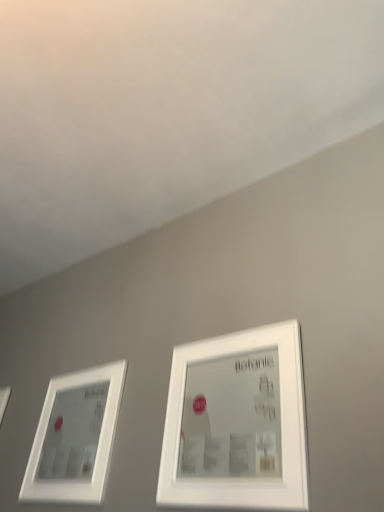
Describe the element at coordinates (237, 423) in the screenshot. This screenshot has height=512, width=384. I see `white matte picture frame at center, positioned as the first picture frame in right-to-left order` at that location.

This screenshot has height=512, width=384. Identify the location of white matte picture frame at center, the 2th picture frame positioned from the left. (237, 423).

How much space does white matte picture frame at center, positioned as the first picture frame in right-to-left order, occupy vertically?

white matte picture frame at center, positioned as the first picture frame in right-to-left order, is 16.57 inches in height.

Measure the distance between white matte picture frame at center, the 2th picture frame positioned from the left, and camera.

A distance of 32.83 inches exists between white matte picture frame at center, the 2th picture frame positioned from the left, and camera.

This screenshot has height=512, width=384. Describe the element at coordinates (75, 437) in the screenshot. I see `white matte picture frame at left, the second picture frame viewed from the right` at that location.

Find the location of `white matte picture frame at left, the second picture frame viewed from the right`. white matte picture frame at left, the second picture frame viewed from the right is located at coordinates (75, 437).

The height and width of the screenshot is (512, 384). What are the coordinates of `white matte picture frame at center, the 2th picture frame positioned from the left` in the screenshot? It's located at (237, 423).

Which object is positioned more to the right, white matte picture frame at left, which ranks as the 1th picture frame in left-to-right order, or white matte picture frame at center, the 2th picture frame positioned from the left?

From the viewer's perspective, white matte picture frame at center, the 2th picture frame positioned from the left, appears more on the right side.

Is white matte picture frame at left, the second picture frame viewed from the right, positioned before white matte picture frame at center, positioned as the first picture frame in right-to-left order?

No.

Does point (113, 381) come closer to viewer compared to point (281, 335)?

No, it is not.

In the scene shown: From the image's perspective, does white matte picture frame at left, which ranks as the 1th picture frame in left-to-right order, appear higher than white matte picture frame at center, positioned as the first picture frame in right-to-left order?

No, from the image's perspective, white matte picture frame at left, which ranks as the 1th picture frame in left-to-right order, is not over white matte picture frame at center, positioned as the first picture frame in right-to-left order.

From a real-world perspective, who is located higher, white matte picture frame at left, the second picture frame viewed from the right, or white matte picture frame at center, the 2th picture frame positioned from the left?

white matte picture frame at left, the second picture frame viewed from the right.

Looking at their sizes, would you say white matte picture frame at left, which ranks as the 1th picture frame in left-to-right order, is wider or thinner than white matte picture frame at center, the 2th picture frame positioned from the left?

Clearly, white matte picture frame at left, which ranks as the 1th picture frame in left-to-right order, has more width compared to white matte picture frame at center, the 2th picture frame positioned from the left.

Does white matte picture frame at left, the second picture frame viewed from the right, have a lesser height compared to white matte picture frame at center, the 2th picture frame positioned from the left?

No, white matte picture frame at left, the second picture frame viewed from the right, is not shorter than white matte picture frame at center, the 2th picture frame positioned from the left.

Can you confirm if white matte picture frame at left, which ranks as the 1th picture frame in left-to-right order, is bigger than white matte picture frame at center, the 2th picture frame positioned from the left?

Indeed, white matte picture frame at left, which ranks as the 1th picture frame in left-to-right order, has a larger size compared to white matte picture frame at center, the 2th picture frame positioned from the left.

Would you say white matte picture frame at left, which ranks as the 1th picture frame in left-to-right order, is outside white matte picture frame at center, positioned as the first picture frame in right-to-left order?

Absolutely, white matte picture frame at left, which ranks as the 1th picture frame in left-to-right order, is external to white matte picture frame at center, positioned as the first picture frame in right-to-left order.

Is white matte picture frame at left, which ranks as the 1th picture frame in left-to-right order, next to white matte picture frame at center, positioned as the first picture frame in right-to-left order?

They are not placed beside each other.

Is white matte picture frame at left, which ranks as the 1th picture frame in left-to-right order, facing towards white matte picture frame at center, positioned as the first picture frame in right-to-left order?

No, white matte picture frame at left, which ranks as the 1th picture frame in left-to-right order, does not turn towards white matte picture frame at center, positioned as the first picture frame in right-to-left order.

How different are the orientations of white matte picture frame at left, which ranks as the 1th picture frame in left-to-right order, and white matte picture frame at center, positioned as the first picture frame in right-to-left order, in degrees?

white matte picture frame at left, which ranks as the 1th picture frame in left-to-right order, and white matte picture frame at center, positioned as the first picture frame in right-to-left order, are facing 0.098 degrees away from each other.

I want to click on picture frame located below the white matte picture frame at center, positioned as the first picture frame in right-to-left order (from the image's perspective), so click(x=75, y=437).

Does white matte picture frame at center, positioned as the first picture frame in right-to-left order, appear on the left side of white matte picture frame at left, the second picture frame viewed from the right?

Incorrect, white matte picture frame at center, positioned as the first picture frame in right-to-left order, is not on the left side of white matte picture frame at left, the second picture frame viewed from the right.

Considering the relative positions of white matte picture frame at center, positioned as the first picture frame in right-to-left order, and white matte picture frame at left, which ranks as the 1th picture frame in left-to-right order, in the image provided, is white matte picture frame at center, positioned as the first picture frame in right-to-left order, behind white matte picture frame at left, which ranks as the 1th picture frame in left-to-right order,?

No, white matte picture frame at center, positioned as the first picture frame in right-to-left order, is in front of white matte picture frame at left, which ranks as the 1th picture frame in left-to-right order.

Considering the points (247, 360) and (113, 435), which point is in front, point (247, 360) or point (113, 435)?

The point (247, 360) is closer to the camera.

From the image's perspective, does white matte picture frame at center, positioned as the first picture frame in right-to-left order, appear higher than white matte picture frame at left, the second picture frame viewed from the right?

Correct, white matte picture frame at center, positioned as the first picture frame in right-to-left order, appears higher than white matte picture frame at left, the second picture frame viewed from the right, in the image.

From a real-world perspective, is white matte picture frame at center, positioned as the first picture frame in right-to-left order, positioned over white matte picture frame at left, the second picture frame viewed from the right, based on gravity?

No, from a real-world perspective, white matte picture frame at center, positioned as the first picture frame in right-to-left order, is not on top of white matte picture frame at left, the second picture frame viewed from the right.

From the picture: Considering the relative sizes of white matte picture frame at center, the 2th picture frame positioned from the left, and white matte picture frame at left, which ranks as the 1th picture frame in left-to-right order, in the image provided, is white matte picture frame at center, the 2th picture frame positioned from the left, wider than white matte picture frame at left, which ranks as the 1th picture frame in left-to-right order,?

In fact, white matte picture frame at center, the 2th picture frame positioned from the left, might be narrower than white matte picture frame at left, which ranks as the 1th picture frame in left-to-right order.

Considering the relative sizes of white matte picture frame at center, the 2th picture frame positioned from the left, and white matte picture frame at left, which ranks as the 1th picture frame in left-to-right order, in the image provided, is white matte picture frame at center, the 2th picture frame positioned from the left, shorter than white matte picture frame at left, which ranks as the 1th picture frame in left-to-right order,?

Yes.

Who is bigger, white matte picture frame at center, positioned as the first picture frame in right-to-left order, or white matte picture frame at left, which ranks as the 1th picture frame in left-to-right order?

white matte picture frame at left, which ranks as the 1th picture frame in left-to-right order, is bigger.

Is white matte picture frame at center, the 2th picture frame positioned from the left, situated inside white matte picture frame at left, which ranks as the 1th picture frame in left-to-right order, or outside?

white matte picture frame at center, the 2th picture frame positioned from the left, is outside white matte picture frame at left, which ranks as the 1th picture frame in left-to-right order.

Is white matte picture frame at center, positioned as the first picture frame in right-to-left order, placed right next to white matte picture frame at left, the second picture frame viewed from the right?

No, white matte picture frame at center, positioned as the first picture frame in right-to-left order, is not touching white matte picture frame at left, the second picture frame viewed from the right.

From the picture: Is white matte picture frame at left, which ranks as the 1th picture frame in left-to-right order, at the back of white matte picture frame at center, the 2th picture frame positioned from the left?

white matte picture frame at center, the 2th picture frame positioned from the left, does not have its back to white matte picture frame at left, which ranks as the 1th picture frame in left-to-right order.

Locate an element on the screen. Image resolution: width=384 pixels, height=512 pixels. picture frame on the right of the white matte picture frame at left, which ranks as the 1th picture frame in left-to-right order is located at coordinates (237, 423).

Locate an element on the screen. The image size is (384, 512). picture frame below the white matte picture frame at center, positioned as the first picture frame in right-to-left order (from the image's perspective) is located at coordinates (75, 437).

Locate an element on the screen. This screenshot has width=384, height=512. picture frame directly beneath the white matte picture frame at left, which ranks as the 1th picture frame in left-to-right order (from a real-world perspective) is located at coordinates (237, 423).